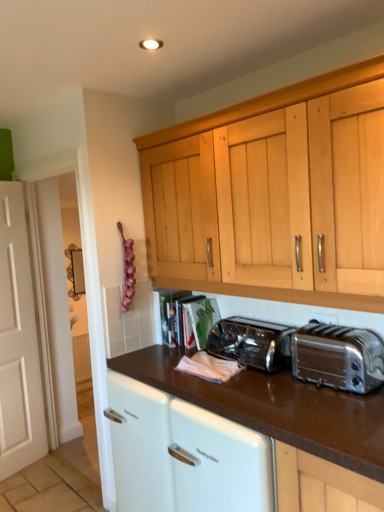
Question: From the image's perspective, would you say silver metallic toaster at right, the second toaster positioned from the back, is positioned over brown glossy countertop at center?

Choices:
 (A) yes
 (B) no

Answer: (A)

Question: Is silver metallic toaster at right, the second toaster positioned from the back, facing towards brown glossy countertop at center?

Choices:
 (A) no
 (B) yes

Answer: (A)

Question: Is silver metallic toaster at right, the second toaster positioned from the back, to the left of brown glossy countertop at center from the viewer's perspective?

Choices:
 (A) no
 (B) yes

Answer: (A)

Question: Is silver metallic toaster at right, which is the first toaster in front-to-back order, thinner than brown glossy countertop at center?

Choices:
 (A) yes
 (B) no

Answer: (A)

Question: Considering the relative positions of silver metallic toaster at right, the second toaster positioned from the back, and brown glossy countertop at center in the image provided, is silver metallic toaster at right, the second toaster positioned from the back, in front of brown glossy countertop at center?

Choices:
 (A) yes
 (B) no

Answer: (B)

Question: Choose the correct answer: Is satin silver toaster at center, marked as the second toaster in a front-to-back arrangement, inside brown glossy countertop at center or outside it?

Choices:
 (A) inside
 (B) outside

Answer: (B)

Question: From a real-world perspective, is satin silver toaster at center, marked as the second toaster in a front-to-back arrangement, positioned above or below brown glossy countertop at center?

Choices:
 (A) below
 (B) above

Answer: (B)

Question: Considering the positions of satin silver toaster at center, which is the 1th toaster from back to front, and brown glossy countertop at center in the image, is satin silver toaster at center, which is the 1th toaster from back to front, taller or shorter than brown glossy countertop at center?

Choices:
 (A) tall
 (B) short

Answer: (B)

Question: From the image's perspective, is satin silver toaster at center, which is the 1th toaster from back to front, located above or below brown glossy countertop at center?

Choices:
 (A) below
 (B) above

Answer: (B)

Question: In terms of height, does brown glossy countertop at center look taller or shorter compared to satin silver toaster at center, which is the 1th toaster from back to front?

Choices:
 (A) tall
 (B) short

Answer: (A)

Question: Looking at the image, does brown glossy countertop at center seem bigger or smaller compared to satin silver toaster at center, which is the 1th toaster from back to front?

Choices:
 (A) big
 (B) small

Answer: (A)

Question: Considering the positions of point 162,347 and point 276,368, is point 162,347 closer or farther from the camera than point 276,368?

Choices:
 (A) closer
 (B) farther

Answer: (B)

Question: From the image's perspective, is brown glossy countertop at center above or below satin silver toaster at center, marked as the second toaster in a front-to-back arrangement?

Choices:
 (A) below
 (B) above

Answer: (A)

Question: Is silver metallic toaster at right, the second toaster positioned from the back, wider or thinner than satin silver toaster at center, which is the 1th toaster from back to front?

Choices:
 (A) wide
 (B) thin

Answer: (B)

Question: Considering the relative positions of silver metallic toaster at right, the second toaster positioned from the back, and satin silver toaster at center, which is the 1th toaster from back to front, in the image provided, is silver metallic toaster at right, the second toaster positioned from the back, to the left or to the right of satin silver toaster at center, which is the 1th toaster from back to front,?

Choices:
 (A) right
 (B) left

Answer: (A)